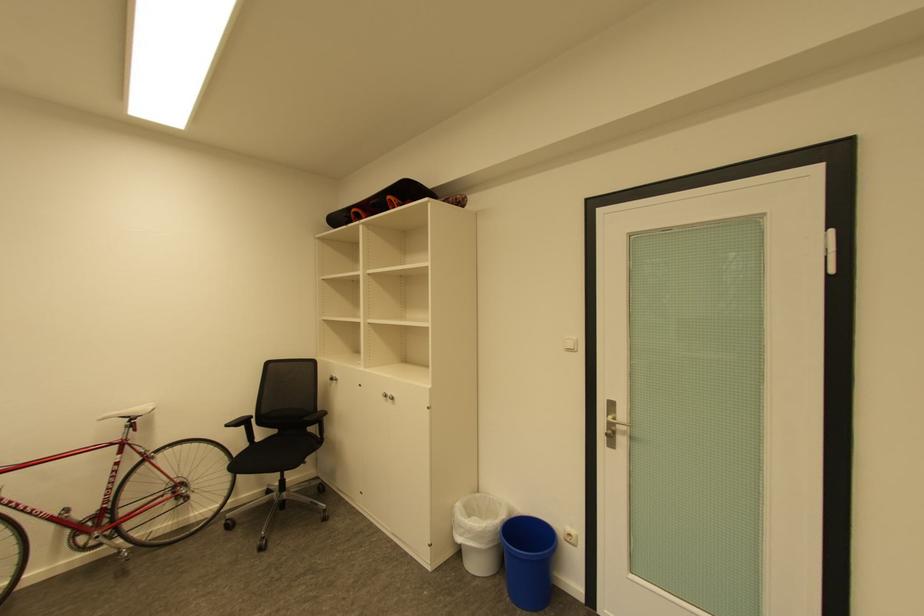
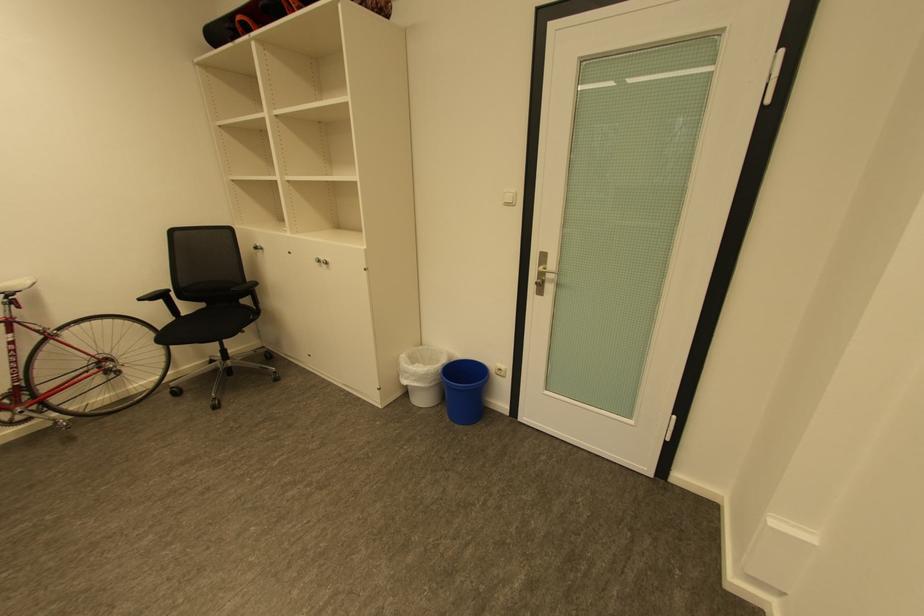
Where in the second image is the point corresponding to the point at 614,436 from the first image?

(543, 284)